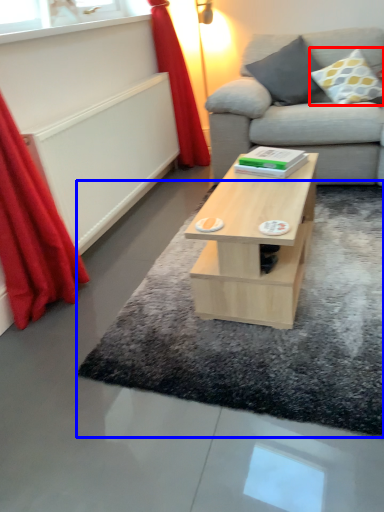
Question: Which point is closer to the camera, pillow (highlighted by a red box) or mat (highlighted by a blue box)?

Choices:
 (A) pillow
 (B) mat

Answer: (B)